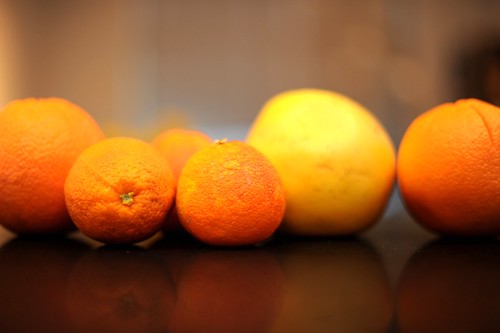
This screenshot has width=500, height=333. I want to click on table, so click(x=263, y=282).